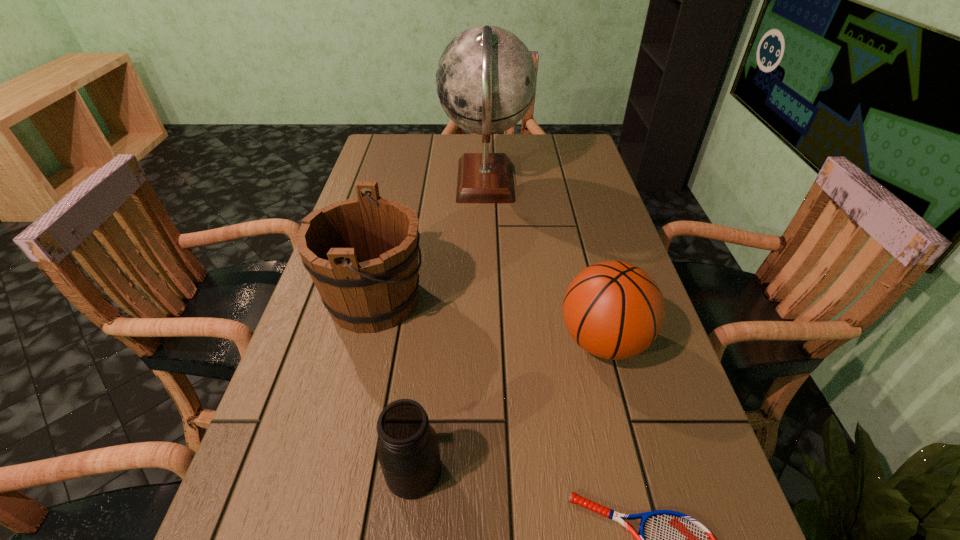
Identify the location of empty location between the basketball and the jar. Image resolution: width=960 pixels, height=540 pixels. (509, 406).

Identify the location of empty space that is in between the third tallest object and the farthest object. This screenshot has height=540, width=960. 544,262.

Where is `empty space between the fourth tallest object and the third shortest object`? Image resolution: width=960 pixels, height=540 pixels. empty space between the fourth tallest object and the third shortest object is located at coordinates (x=509, y=406).

The image size is (960, 540). I want to click on free space between the third tallest object and the wine bucket, so click(x=489, y=321).

Identify the location of object that can be found as the closest to the globe. (362, 253).

Locate an element on the screen. the third closest object to the fourth shortest object is located at coordinates (614, 310).

I want to click on vacant area in the image that satisfies the following two spatial constraints: 1. on the side of the wine bucket with the handle for carrying; 2. on the back side of the third shortest object, so click(364, 341).

At what (x,y) coordinates should I click in order to perform the action: click on vacant region that satisfies the following two spatial constraints: 1. at the equator of the tallest object; 2. on the left side of the third shortest object. Please return your answer as a coordinate pair (x, y). Image resolution: width=960 pixels, height=540 pixels. Looking at the image, I should click on (488, 341).

The image size is (960, 540). In order to click on free location that satisfies the following two spatial constraints: 1. on the back side of the third tallest object; 2. at the equator of the tallest object in this screenshot , I will do `click(563, 183)`.

Locate an element on the screen. The height and width of the screenshot is (540, 960). vacant space that satisfies the following two spatial constraints: 1. on the side of the fourth shortest object with the handle for carrying; 2. on the right side of the basketball is located at coordinates (364, 341).